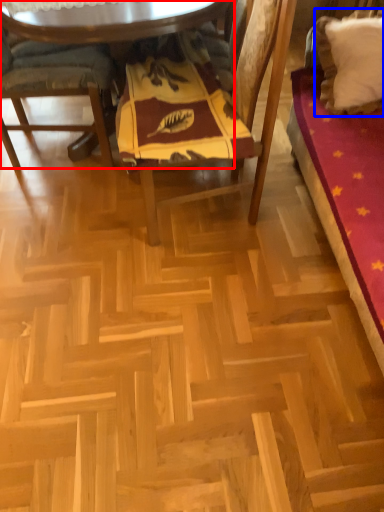
Question: Which of the following is the farthest to the observer, table (highlighted by a red box) or pillow (highlighted by a blue box)?

Choices:
 (A) table
 (B) pillow

Answer: (B)